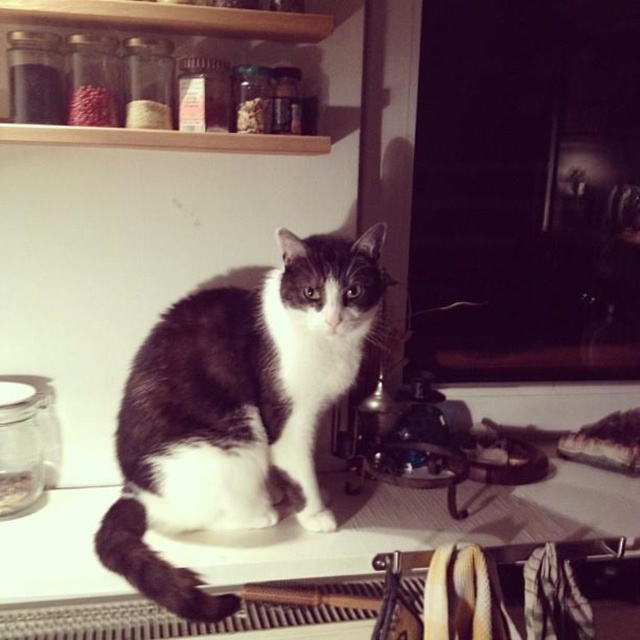
Question: Among these points, which one is nearest to the camera?

Choices:
 (A) (536, 524)
 (B) (205, 380)

Answer: (B)

Question: Observing the image, what is the correct spatial positioning of soft fur cat at center in reference to wooden shelf at upper center?

Choices:
 (A) right
 (B) left

Answer: (A)

Question: Which of the following is the closest to the observer?

Choices:
 (A) (45, 1)
 (B) (221, 500)

Answer: (A)

Question: Is white glossy counter top at center thinner than wooden shelf at upper center?

Choices:
 (A) yes
 (B) no

Answer: (B)

Question: Which point is closer to the camera?

Choices:
 (A) white glossy counter top at center
 (B) wooden shelf at upper center

Answer: (A)

Question: Where is white glossy counter top at center located in relation to wooden shelf at upper center in the image?

Choices:
 (A) left
 (B) right

Answer: (B)